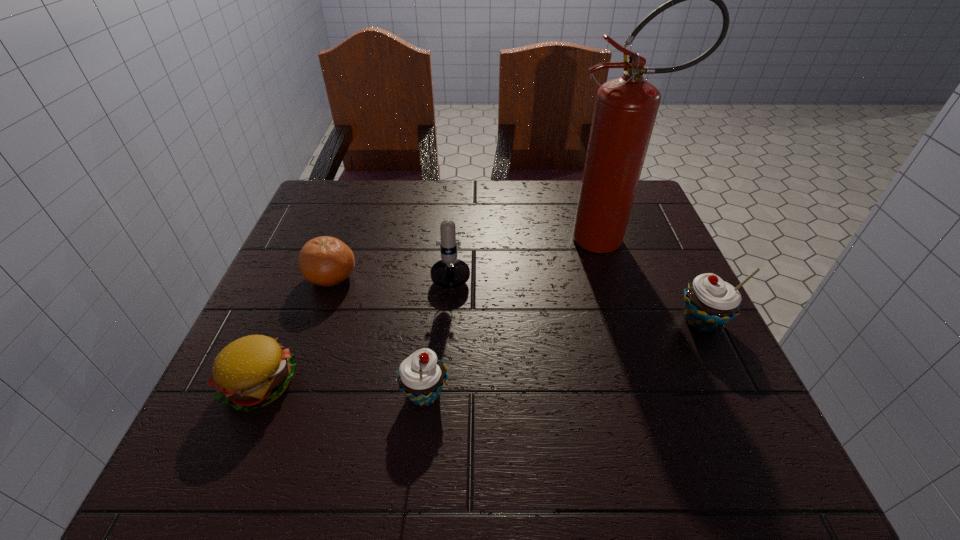
If the aim is uniform spacing by inserting an additional cupcake among them, please point to a vacant space for this new cupcake. Please provide its 2D coordinates. Your answer should be formatted as a tuple, i.e. [(x, y)], where the tuple contains the x and y coordinates of a point satisfying the conditions above.

[(573, 354)]